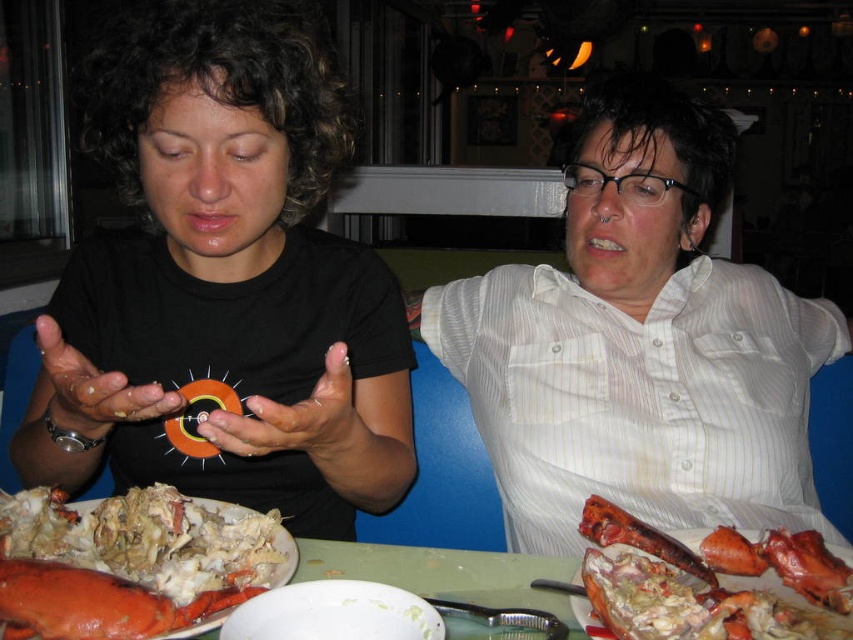
Who is more distant from viewer, (109,636) or (579,577)?

The point (579,577) is more distant.

Is shiny red lobster at lower left wider than shiny lobster at lower right?

Incorrect, shiny red lobster at lower left's width does not surpass shiny lobster at lower right's.

Locate an element on the screen. This screenshot has width=853, height=640. shiny red lobster at lower left is located at coordinates (94, 604).

Is white striped shirt at center wider than shiny lobster claw at lower left?

Indeed, white striped shirt at center has a greater width compared to shiny lobster claw at lower left.

How much distance is there between white striped shirt at center and shiny lobster claw at lower left?

white striped shirt at center is 56.06 centimeters away from shiny lobster claw at lower left.

I want to click on white striped shirt at center, so click(x=639, y=344).

I want to click on white striped shirt at center, so click(639, 344).

This screenshot has width=853, height=640. Describe the element at coordinates (639, 344) in the screenshot. I see `white striped shirt at center` at that location.

Is white striped shirt at center bigger than shiny lobster at lower right?

Indeed, white striped shirt at center has a larger size compared to shiny lobster at lower right.

Where is `white striped shirt at center`? This screenshot has width=853, height=640. white striped shirt at center is located at coordinates (639, 344).

I want to click on white striped shirt at center, so click(639, 344).